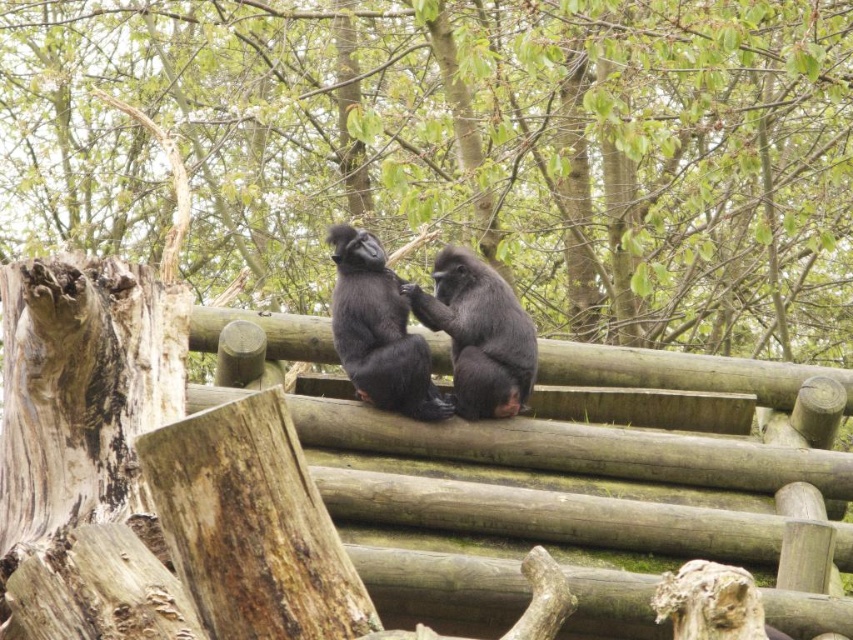
Question: Can you confirm if smooth bark tree trunk at left is positioned above shiny black monkey at center?

Choices:
 (A) no
 (B) yes

Answer: (B)

Question: Which of the following is the farthest from the observer?

Choices:
 (A) black fur monkey at center
 (B) smooth bark tree trunk at left
 (C) shiny black monkey at center

Answer: (B)

Question: Is smooth bark tree trunk at left bigger than shiny black monkey at center?

Choices:
 (A) no
 (B) yes

Answer: (B)

Question: Among these objects, which one is nearest to the camera?

Choices:
 (A) smooth bark tree trunk at left
 (B) shiny black monkey at center
 (C) black fur monkey at center

Answer: (C)

Question: Is smooth bark tree trunk at left to the left of shiny black monkey at center from the viewer's perspective?

Choices:
 (A) no
 (B) yes

Answer: (B)

Question: Which of the following is the closest to the observer?

Choices:
 (A) (370, 404)
 (B) (483, 321)

Answer: (A)